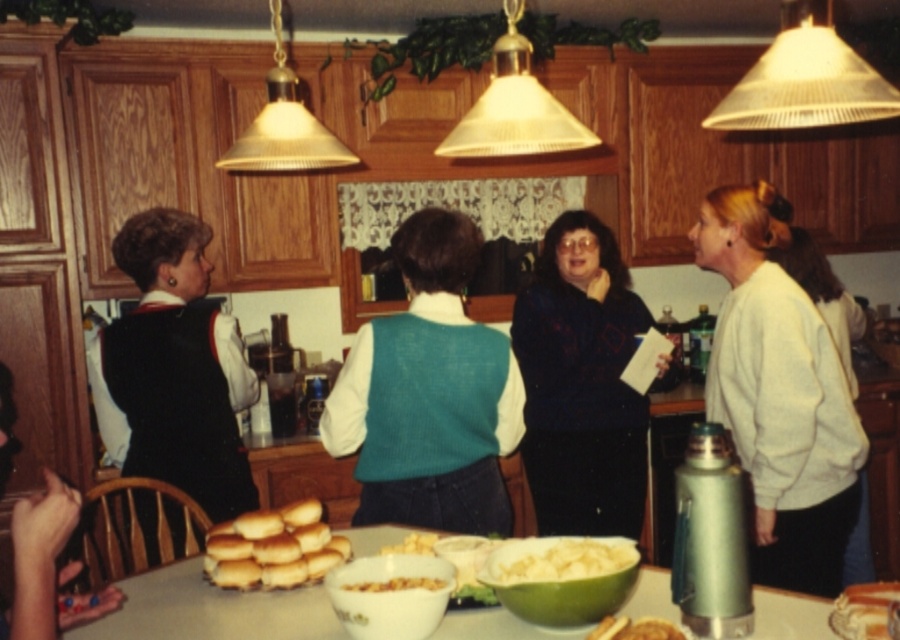
You are a guest at the gathering and want to place a small gift on the table between the black knit vest at left and the golden brown bread rolls at center. Which object should you move to make space?

The black knit vest at left is wider than the golden brown bread rolls at center, so you should move the black knit vest at left to create enough space for the gift.

You are a guest at the gathering and want to place a small plate between the white sweater at right and the golden brown bread at table center. Can you fit it there?

The white sweater at right is wider than the golden brown bread at table center, so there should be enough space to place a small plate between them.